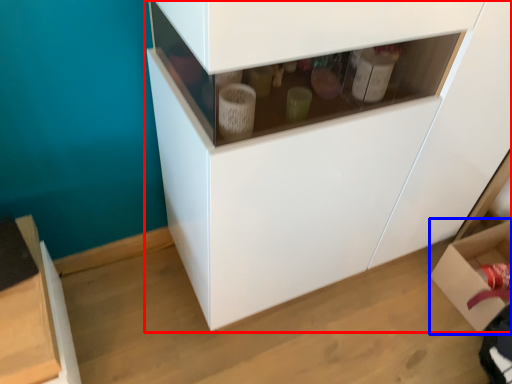
Question: Which object appears closest to the camera in this image, cabinetry (highlighted by a red box) or cardboard box (highlighted by a blue box)?

Choices:
 (A) cabinetry
 (B) cardboard box

Answer: (A)